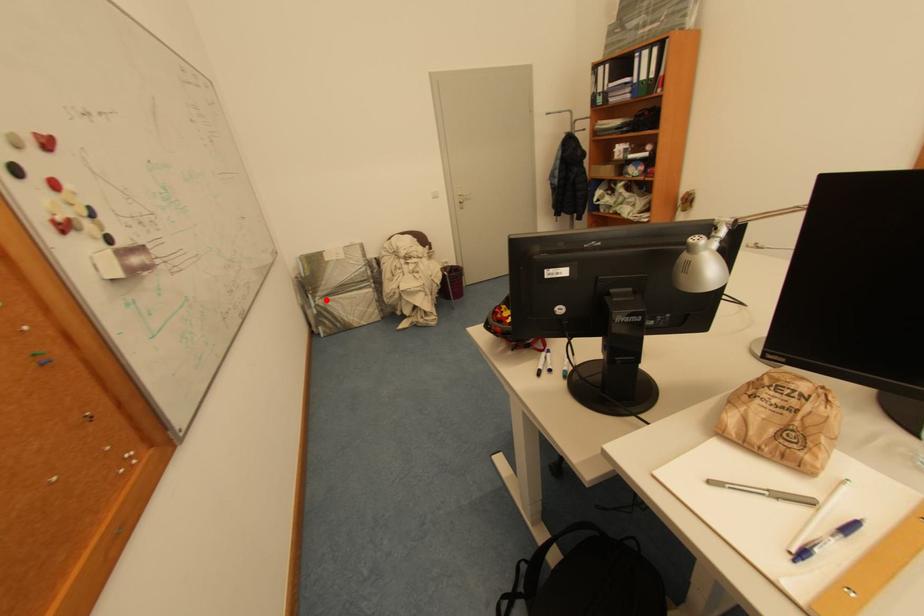
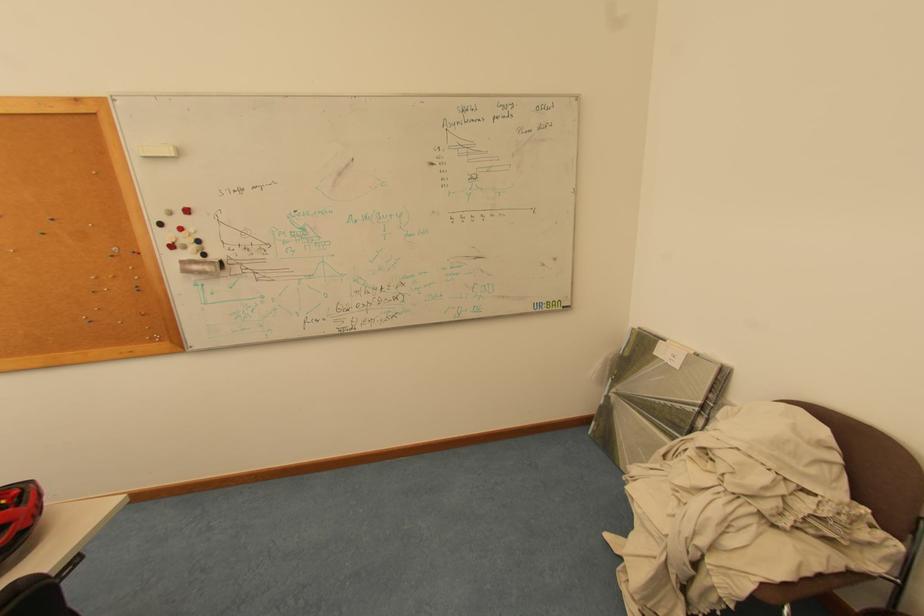
Question: I am providing you with two images of the same scene from different viewpoints. A red point is shown in image1. For the corresponding object point in image2, is it positioned nearer or farther from the camera?

Choices:
 (A) Nearer
 (B) Farther

Answer: (B)